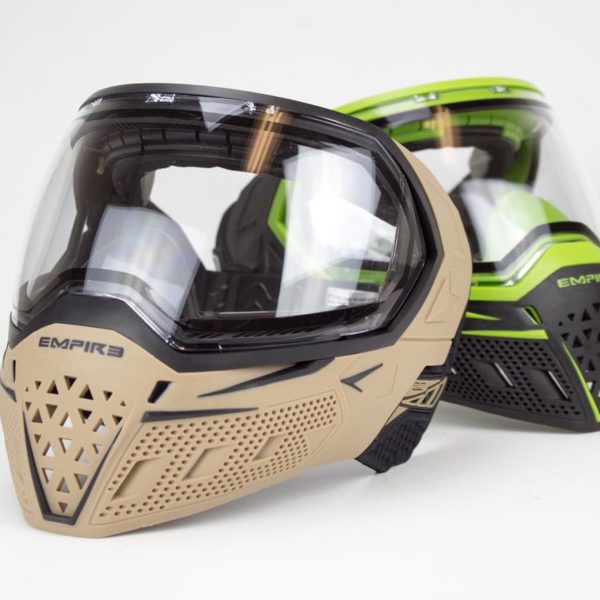
Where is `white surface`? This screenshot has width=600, height=600. white surface is located at coordinates (526, 477).